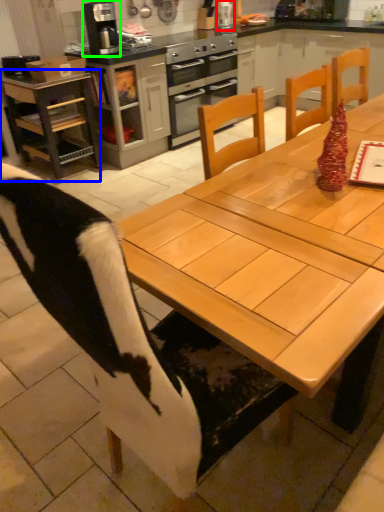
Question: Based on their relative distances, which object is farther from appliance (highlighted by a red box)? Choose from desk (highlighted by a blue box) and kitchen appliance (highlighted by a green box).

Choices:
 (A) desk
 (B) kitchen appliance

Answer: (A)